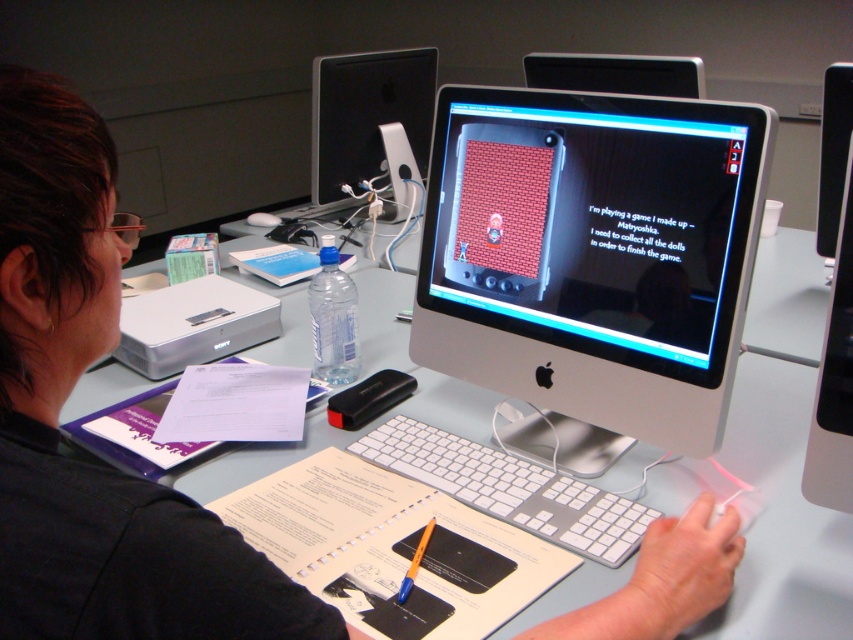
Question: Which point appears farthest from the camera in this image?

Choices:
 (A) (605, 65)
 (B) (328, 196)
 (C) (339, 294)
 (D) (730, 156)

Answer: (B)

Question: Among these objects, which one is nearest to the camera?

Choices:
 (A) satin silver monitor at center
 (B) clear plastic bottle at center
 (C) satin black monitor at upper center
 (D) black glossy monitor at upper center

Answer: (A)

Question: Does satin silver monitor at center appear on the right side of clear plastic bottle at center?

Choices:
 (A) yes
 (B) no

Answer: (A)

Question: Is black glossy monitor at upper center positioned at the back of clear plastic bottle at center?

Choices:
 (A) no
 (B) yes

Answer: (B)

Question: Which point appears closest to the camera in this image?

Choices:
 (A) (519, 506)
 (B) (343, 374)
 (C) (630, 372)

Answer: (A)

Question: Considering the relative positions of satin silver monitor at center and black glossy monitor at upper center in the image provided, where is satin silver monitor at center located with respect to black glossy monitor at upper center?

Choices:
 (A) right
 (B) left

Answer: (B)